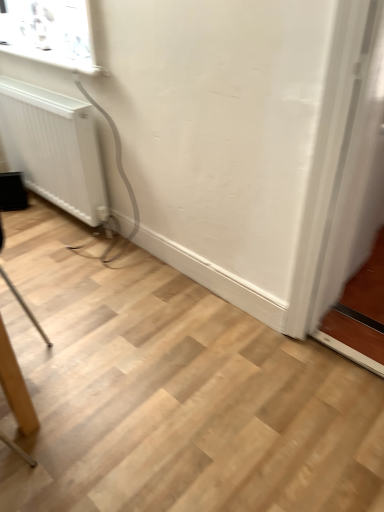
What is the approximate height of white matte radiator at left?

It is 26.61 inches.

Describe the element at coordinates (53, 148) in the screenshot. The width and height of the screenshot is (384, 512). I see `white matte radiator at left` at that location.

At what (x,y) coordinates should I click in order to perform the action: click on white matte radiator at left. Please return your answer as a coordinate pair (x, y). Looking at the image, I should click on (53, 148).

I want to click on white matte radiator at left, so click(x=53, y=148).